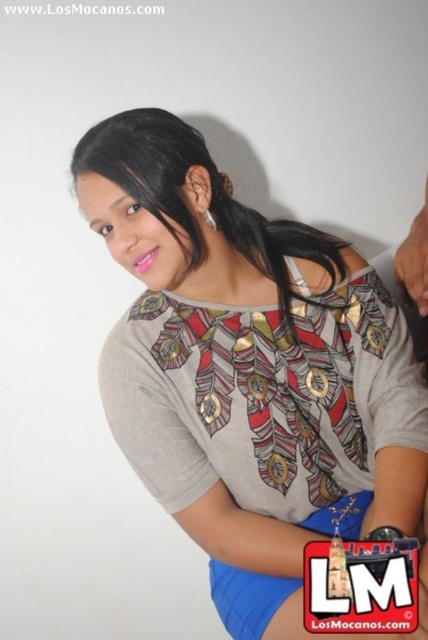
Question: Does printed fabric blouse at center lie in front of black shiny hair at upper center?

Choices:
 (A) no
 (B) yes

Answer: (B)

Question: Can you confirm if printed fabric blouse at center is thinner than black shiny hair at upper center?

Choices:
 (A) no
 (B) yes

Answer: (A)

Question: In this image, where is printed fabric blouse at center located relative to black shiny hair at upper center?

Choices:
 (A) left
 (B) right

Answer: (B)

Question: Which point is farther to the camera?

Choices:
 (A) black shiny hair at upper center
 (B) printed fabric blouse at center

Answer: (A)